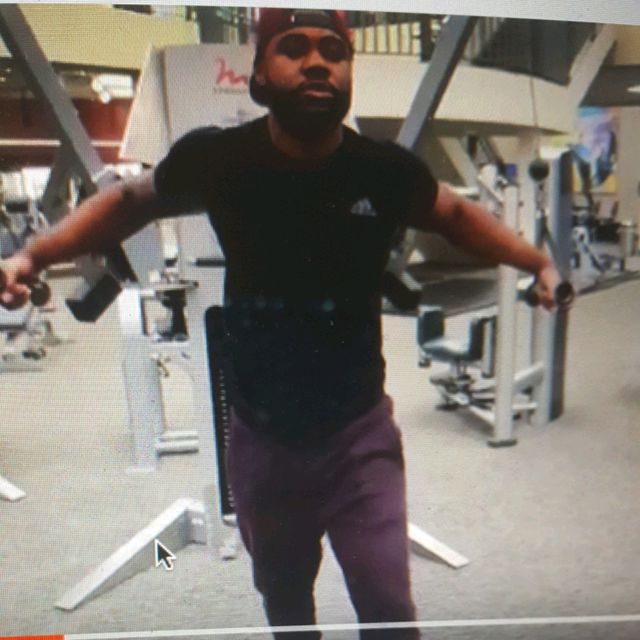
Identify the location of brown wall. (99, 116).